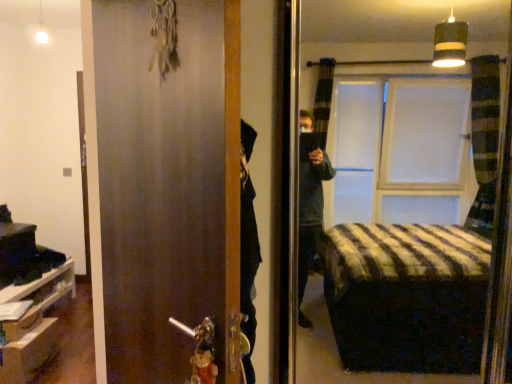
This screenshot has width=512, height=384. What do you see at coordinates (34, 325) in the screenshot?
I see `white matte cabinet at lower left` at bounding box center [34, 325].

The height and width of the screenshot is (384, 512). Describe the element at coordinates (29, 353) in the screenshot. I see `wooden drawer at lower left` at that location.

The image size is (512, 384). Describe the element at coordinates (163, 183) in the screenshot. I see `matte brown door at center` at that location.

You are a GUI agent. You are given a task and a screenshot of the screen. Output one action in this format:
    pyautogui.click(x=<x>, y=<y>)
    Task: Click on the white matte cabinet at lower left
    The width and height of the screenshot is (512, 384).
    Given the screenshot: What is the action you would take?
    pyautogui.click(x=34, y=325)

Between wooden drawer at lower left and white matte cabinet at lower left, which one has larger size?

white matte cabinet at lower left.

Where is `drawer that appears in front of the white matte cabinet at lower left`? drawer that appears in front of the white matte cabinet at lower left is located at coordinates (29, 353).

Does wooden drawer at lower left have a greater height compared to white matte cabinet at lower left?

Incorrect, the height of wooden drawer at lower left is not larger of that of white matte cabinet at lower left.

Measure the distance from wooden drawer at lower left to white matte cabinet at lower left.

wooden drawer at lower left is 6.07 inches from white matte cabinet at lower left.

Locate an element on the screen. door in front of the wooden drawer at lower left is located at coordinates (163, 183).

Considering the sizes of objects matte brown door at center and wooden drawer at lower left in the image provided, who is bigger, matte brown door at center or wooden drawer at lower left?

Bigger between the two is matte brown door at center.

Is matte brown door at center turned away from wooden drawer at lower left?

matte brown door at center is not turned away from wooden drawer at lower left.

Looking at this image, considering the relative sizes of white matte cabinet at lower left and matte brown door at center in the image provided, is white matte cabinet at lower left bigger than matte brown door at center?

Incorrect, white matte cabinet at lower left is not larger than matte brown door at center.

From the image's perspective, between white matte cabinet at lower left and matte brown door at center, which one is located above?

matte brown door at center appears higher in the image.

Could you tell me if white matte cabinet at lower left is turned towards matte brown door at center?

No, white matte cabinet at lower left is not turned towards matte brown door at center.

Where is `door above the white matte cabinet at lower left (from a real-world perspective)`? This screenshot has height=384, width=512. door above the white matte cabinet at lower left (from a real-world perspective) is located at coordinates (163, 183).

Which is more to the left, white matte cabinet at lower left or wooden drawer at lower left?

white matte cabinet at lower left is more to the left.

Is white matte cabinet at lower left positioned with its back to wooden drawer at lower left?

No.

Identify the location of furniture that appears below the matte brown door at center (from the image's perspective). (34, 325).

Can you confirm if matte brown door at center is positioned to the left of white matte cabinet at lower left?

In fact, matte brown door at center is to the right of white matte cabinet at lower left.

Can you confirm if matte brown door at center is bigger than white matte cabinet at lower left?

Yes.

Is point (184, 300) behind point (73, 271)?

No, (184, 300) is in front of (73, 271).

Could you tell me if wooden drawer at lower left is facing matte brown door at center?

No, wooden drawer at lower left is not aimed at matte brown door at center.

Locate an element on the screen. This screenshot has width=512, height=384. drawer located on the left of matte brown door at center is located at coordinates (29, 353).

Is wooden drawer at lower left inside the boundaries of matte brown door at center, or outside?

wooden drawer at lower left cannot be found inside matte brown door at center.

Does point (11, 359) lie in front of point (123, 35)?

No.

Where is `drawer below the white matte cabinet at lower left (from the image's perspective)`? drawer below the white matte cabinet at lower left (from the image's perspective) is located at coordinates (29, 353).

Find the location of a particular element. door in front of the wooden drawer at lower left is located at coordinates (163, 183).

Estimate the real-world distances between objects in this image. Which object is further from white matte cabinet at lower left, matte brown door at center or wooden drawer at lower left?

matte brown door at center lies further to white matte cabinet at lower left than the other object.

Estimate the real-world distances between objects in this image. Which object is further from white matte cabinet at lower left, wooden drawer at lower left or matte brown door at center?

matte brown door at center is further to white matte cabinet at lower left.

Estimate the real-world distances between objects in this image. Which object is further from wooden drawer at lower left, white matte cabinet at lower left or matte brown door at center?

matte brown door at center is positioned further to the anchor wooden drawer at lower left.

Which object lies further to the anchor point matte brown door at center, wooden drawer at lower left or white matte cabinet at lower left?

Among the two, white matte cabinet at lower left is located further to matte brown door at center.

When comparing their distances from matte brown door at center, does white matte cabinet at lower left or wooden drawer at lower left seem further?

white matte cabinet at lower left.

Considering their positions, is matte brown door at center positioned closer to wooden drawer at lower left than white matte cabinet at lower left?

white matte cabinet at lower left.

Find the location of a particular element. The height and width of the screenshot is (384, 512). drawer located between matte brown door at center and white matte cabinet at lower left in the depth direction is located at coordinates (29, 353).